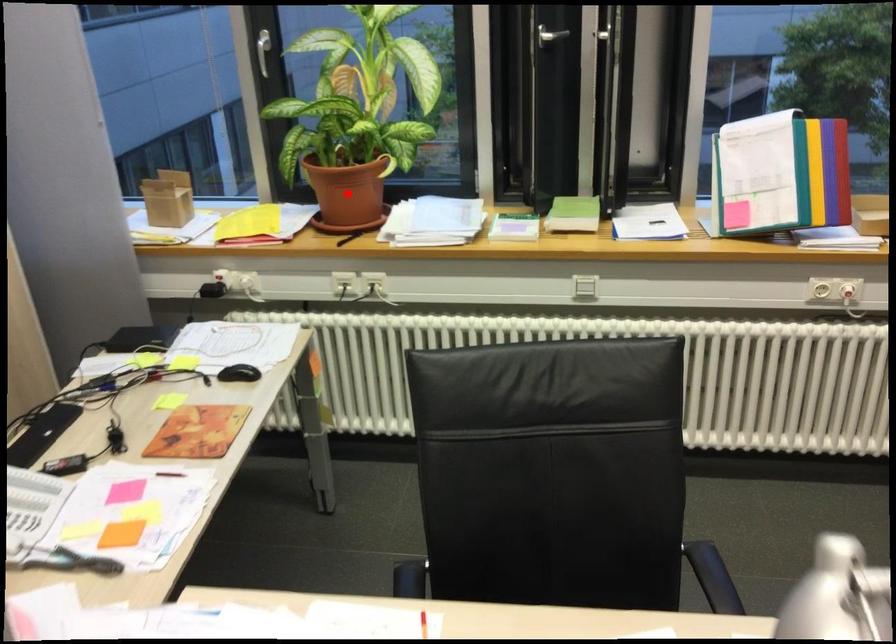
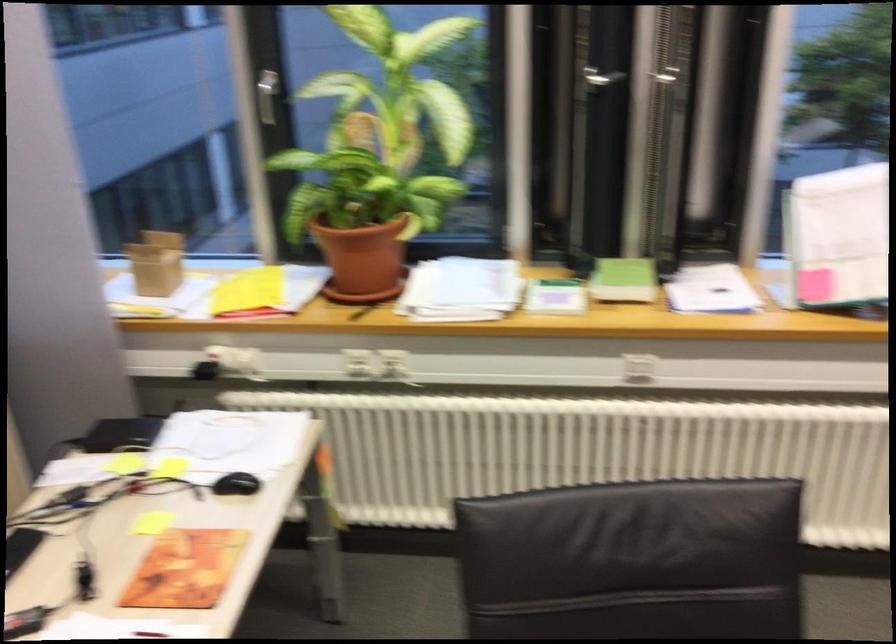
Question: I am providing you with two images of the same scene from different viewpoints. Image1 has a red point marked. In image2, the corresponding 3D location appears at what relative position? Reply with the corresponding letter.

Choices:
 (A) Closer
 (B) Farther

Answer: (A)